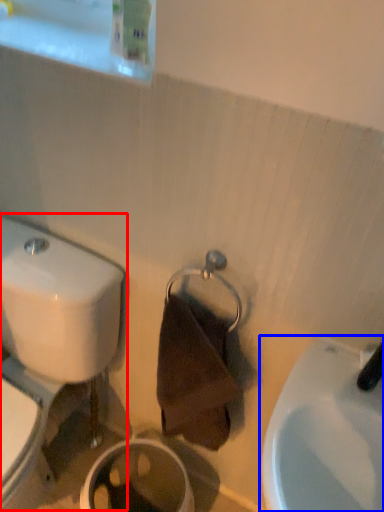
Question: Among these objects, which one is nearest to the camera, toilet (highlighted by a red box) or sink (highlighted by a blue box)?

Choices:
 (A) toilet
 (B) sink

Answer: (B)